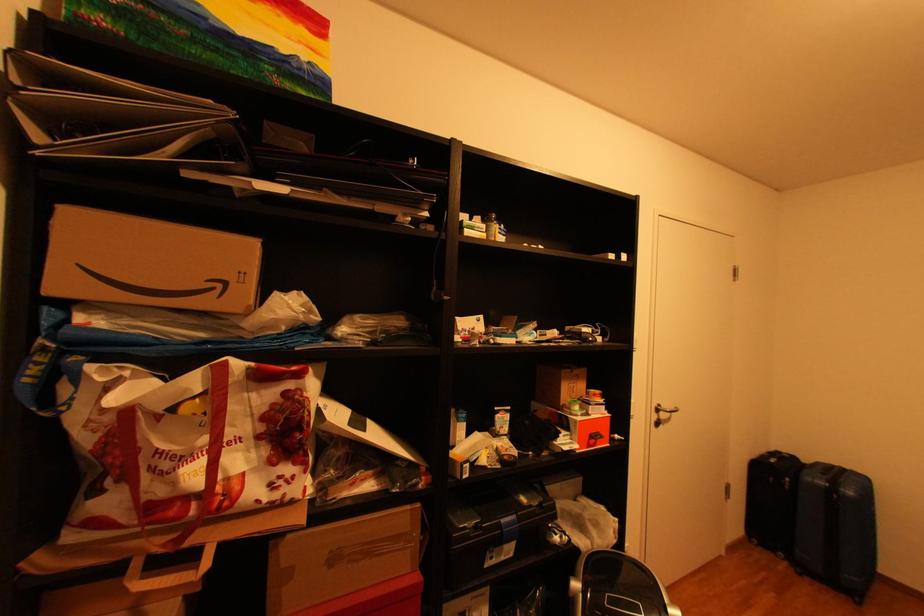
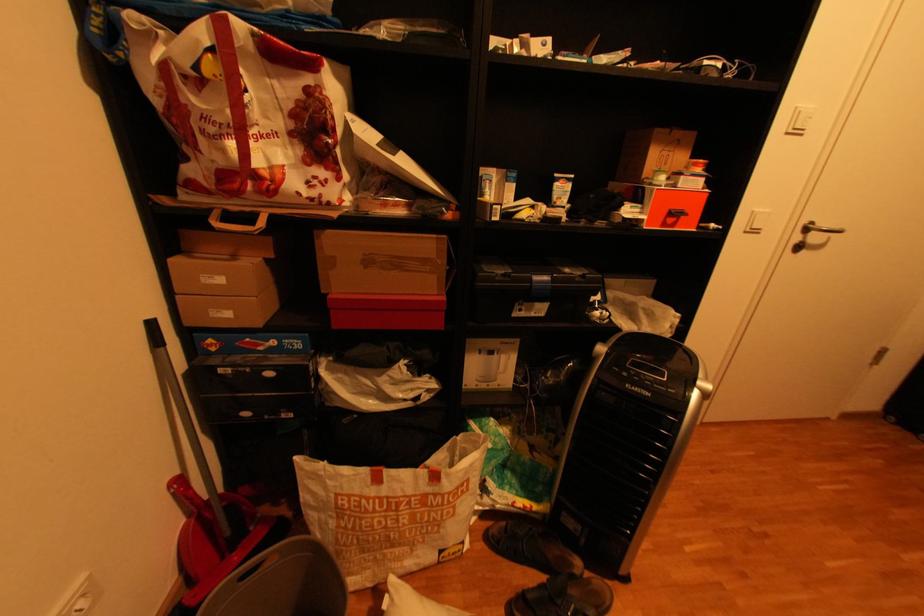
Locate, in the second image, the point that corresponds to the point at 421,511 in the first image.

(446, 238)